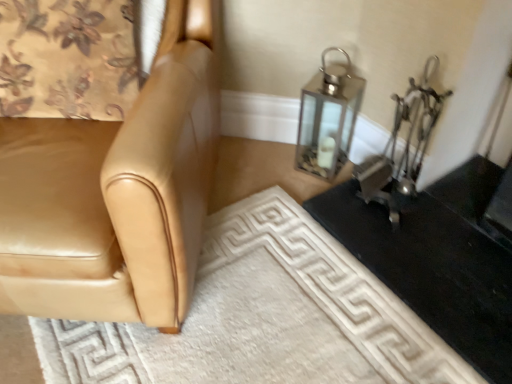
Question: Can you confirm if floral fabric curtain at upper left is thinner than tan leather chair at left?

Choices:
 (A) yes
 (B) no

Answer: (A)

Question: Does floral fabric curtain at upper left have a larger size compared to tan leather chair at left?

Choices:
 (A) no
 (B) yes

Answer: (A)

Question: Can you confirm if floral fabric curtain at upper left is smaller than tan leather chair at left?

Choices:
 (A) no
 (B) yes

Answer: (B)

Question: Is floral fabric curtain at upper left at the left side of tan leather chair at left?

Choices:
 (A) no
 (B) yes

Answer: (A)

Question: Considering the relative positions of floral fabric curtain at upper left and tan leather chair at left in the image provided, is floral fabric curtain at upper left behind tan leather chair at left?

Choices:
 (A) yes
 (B) no

Answer: (A)

Question: Is tan leather chair at left to the left or to the right of metallic lantern at upper right in the image?

Choices:
 (A) left
 (B) right

Answer: (A)

Question: Considering the positions of tan leather chair at left and metallic lantern at upper right in the image, is tan leather chair at left wider or thinner than metallic lantern at upper right?

Choices:
 (A) wide
 (B) thin

Answer: (A)

Question: From a real-world perspective, relative to metallic lantern at upper right, is tan leather chair at left vertically above or below?

Choices:
 (A) above
 (B) below

Answer: (A)

Question: Considering their positions, is tan leather chair at left located in front of or behind metallic lantern at upper right?

Choices:
 (A) front
 (B) behind

Answer: (A)

Question: Is floral fabric curtain at upper left bigger or smaller than tan leather chair at left?

Choices:
 (A) small
 (B) big

Answer: (A)

Question: From a real-world perspective, is floral fabric curtain at upper left physically located above or below tan leather chair at left?

Choices:
 (A) above
 (B) below

Answer: (A)

Question: Is point (111, 26) positioned closer to the camera than point (40, 238)?

Choices:
 (A) farther
 (B) closer

Answer: (A)

Question: Is floral fabric curtain at upper left in front of or behind tan leather chair at left in the image?

Choices:
 (A) behind
 (B) front

Answer: (A)

Question: Considering the positions of white textured doormat at lower center and tan leather chair at left in the image, is white textured doormat at lower center wider or thinner than tan leather chair at left?

Choices:
 (A) wide
 (B) thin

Answer: (B)

Question: Based on their positions, is white textured doormat at lower center located to the left or right of tan leather chair at left?

Choices:
 (A) right
 (B) left

Answer: (A)